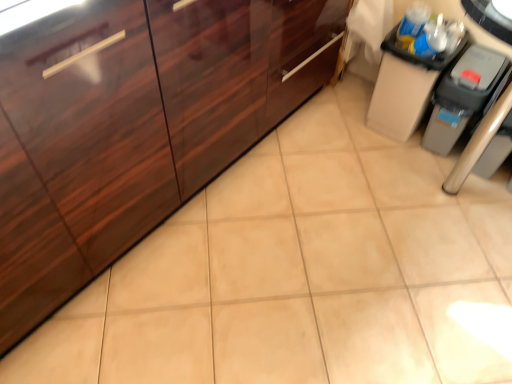
Locate an element on the screen. free location in front of matte black trash can at upper right, acting as the 2th cabinetry starting from the left is located at coordinates (393, 162).